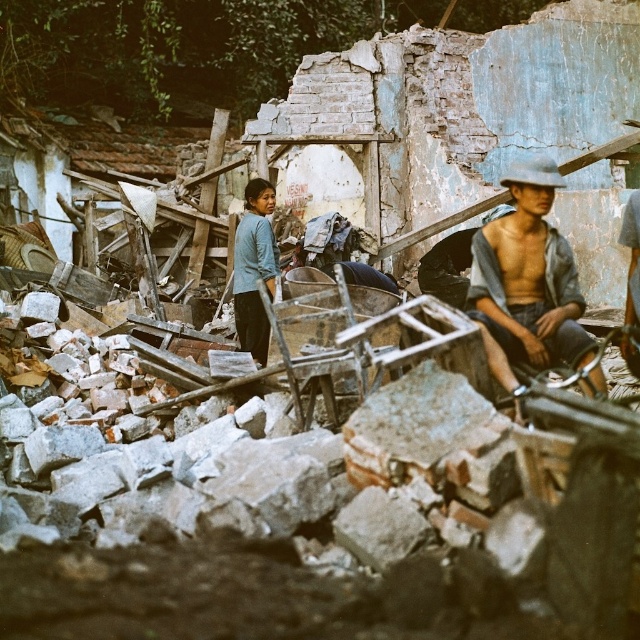
Does gray fabric shirt at center have a lesser height compared to blue fabric shirt at center?

Yes, gray fabric shirt at center is shorter than blue fabric shirt at center.

Can you confirm if gray fabric shirt at center is wider than blue fabric shirt at center?

Yes, gray fabric shirt at center is wider than blue fabric shirt at center.

Who is more forward, (516, 346) or (276, 250)?

Point (516, 346)

Locate an element on the screen. gray fabric shirt at center is located at coordinates (528, 280).